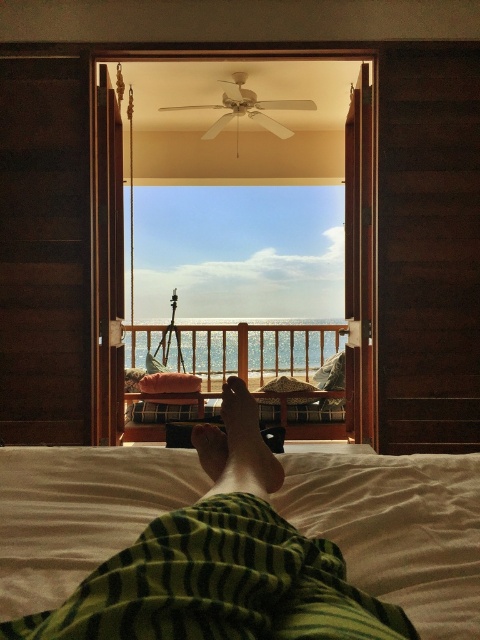
Question: Which object is closer to the camera taking this photo?

Choices:
 (A) wooden bench at center
 (B) transparent glass door at center
 (C) light brown skin at center
 (D) white soft bed at lower center

Answer: (D)

Question: Which point is farther to the camera?

Choices:
 (A) pos(242,342)
 (B) pos(253,406)
 (C) pos(294,68)

Answer: (A)

Question: Does white soft bed at lower center have a greater width compared to wooden bench at center?

Choices:
 (A) no
 (B) yes

Answer: (A)

Question: Which point appears closest to the camera in this image?

Choices:
 (A) (128, 138)
 (B) (275, 481)

Answer: (B)

Question: Is wooden bench at center to the left of light brown skin at center from the viewer's perspective?

Choices:
 (A) yes
 (B) no

Answer: (A)

Question: Is the position of white soft bed at lower center less distant than that of light brown skin at center?

Choices:
 (A) yes
 (B) no

Answer: (A)